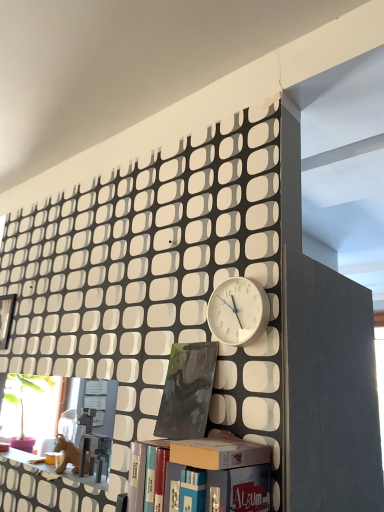
Question: Considering the relative sizes of white matte clock at center and matte plastic shelf at lower left in the image provided, is white matte clock at center wider than matte plastic shelf at lower left?

Choices:
 (A) no
 (B) yes

Answer: (A)

Question: Is matte plastic shelf at lower left at the back of white matte clock at center?

Choices:
 (A) yes
 (B) no

Answer: (B)

Question: Considering the relative sizes of white matte clock at center and matte plastic shelf at lower left in the image provided, is white matte clock at center smaller than matte plastic shelf at lower left?

Choices:
 (A) no
 (B) yes

Answer: (B)

Question: Is white matte clock at center to the right of matte plastic shelf at lower left from the viewer's perspective?

Choices:
 (A) no
 (B) yes

Answer: (B)

Question: From the image's perspective, is white matte clock at center below matte plastic shelf at lower left?

Choices:
 (A) yes
 (B) no

Answer: (B)

Question: Is white matte clock at center far away from matte plastic shelf at lower left?

Choices:
 (A) no
 (B) yes

Answer: (A)

Question: Considering the relative sizes of white matte clock at center and matte black bookcase at lower center in the image provided, is white matte clock at center shorter than matte black bookcase at lower center?

Choices:
 (A) no
 (B) yes

Answer: (B)

Question: Are white matte clock at center and matte black bookcase at lower center located far from each other?

Choices:
 (A) yes
 (B) no

Answer: (B)

Question: Is white matte clock at center touching matte black bookcase at lower center?

Choices:
 (A) no
 (B) yes

Answer: (A)

Question: Is white matte clock at center closer to camera compared to matte black bookcase at lower center?

Choices:
 (A) no
 (B) yes

Answer: (A)

Question: Can you confirm if white matte clock at center is smaller than matte black bookcase at lower center?

Choices:
 (A) no
 (B) yes

Answer: (B)

Question: Is white matte clock at center behind matte black bookcase at lower center?

Choices:
 (A) yes
 (B) no

Answer: (A)

Question: Is matte cardboard box at center smaller than matte plastic shelf at lower left?

Choices:
 (A) yes
 (B) no

Answer: (B)